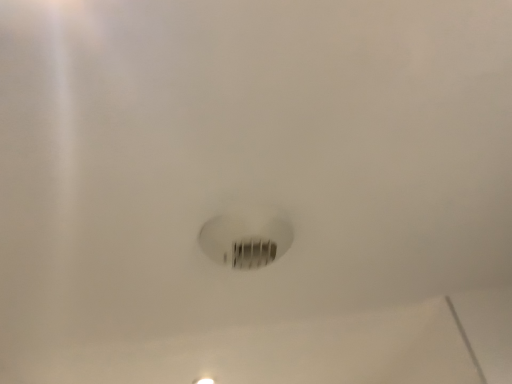
Question: Should I look upward or downward to see white matte light bulb at center?

Choices:
 (A) down
 (B) up

Answer: (A)

Question: Is white matte light bulb at center shorter than white glossy light fixture at center?

Choices:
 (A) no
 (B) yes

Answer: (A)

Question: Does white matte light bulb at center lie in front of white glossy light fixture at center?

Choices:
 (A) yes
 (B) no

Answer: (A)

Question: From a real-world perspective, is white matte light bulb at center physically below white glossy light fixture at center?

Choices:
 (A) no
 (B) yes

Answer: (B)

Question: Is white matte light bulb at center bigger than white glossy light fixture at center?

Choices:
 (A) yes
 (B) no

Answer: (A)

Question: Are white matte light bulb at center and white glossy light fixture at center located far from each other?

Choices:
 (A) yes
 (B) no

Answer: (B)

Question: Could you tell me if white matte light bulb at center is facing white glossy light fixture at center?

Choices:
 (A) yes
 (B) no

Answer: (B)

Question: Considering the relative sizes of white glossy light fixture at center and white matte light bulb at center in the image provided, is white glossy light fixture at center bigger than white matte light bulb at center?

Choices:
 (A) yes
 (B) no

Answer: (B)

Question: Can you confirm if white glossy light fixture at center is wider than white matte light bulb at center?

Choices:
 (A) yes
 (B) no

Answer: (B)

Question: Is white glossy light fixture at center positioned in front of white matte light bulb at center?

Choices:
 (A) yes
 (B) no

Answer: (B)

Question: Can you confirm if white glossy light fixture at center is positioned to the left of white matte light bulb at center?

Choices:
 (A) no
 (B) yes

Answer: (B)

Question: Is white matte light bulb at center at the back of white glossy light fixture at center?

Choices:
 (A) no
 (B) yes

Answer: (A)

Question: From a real-world perspective, is white glossy light fixture at center under white matte light bulb at center?

Choices:
 (A) yes
 (B) no

Answer: (B)

Question: From a real-world perspective, relative to white matte light bulb at center, is white glossy light fixture at center vertically above or below?

Choices:
 (A) below
 (B) above

Answer: (B)